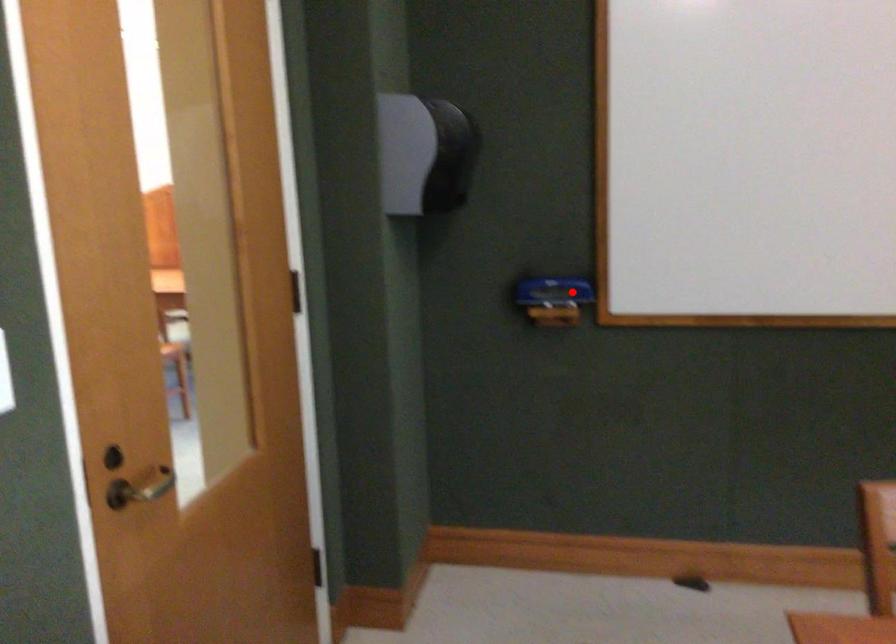
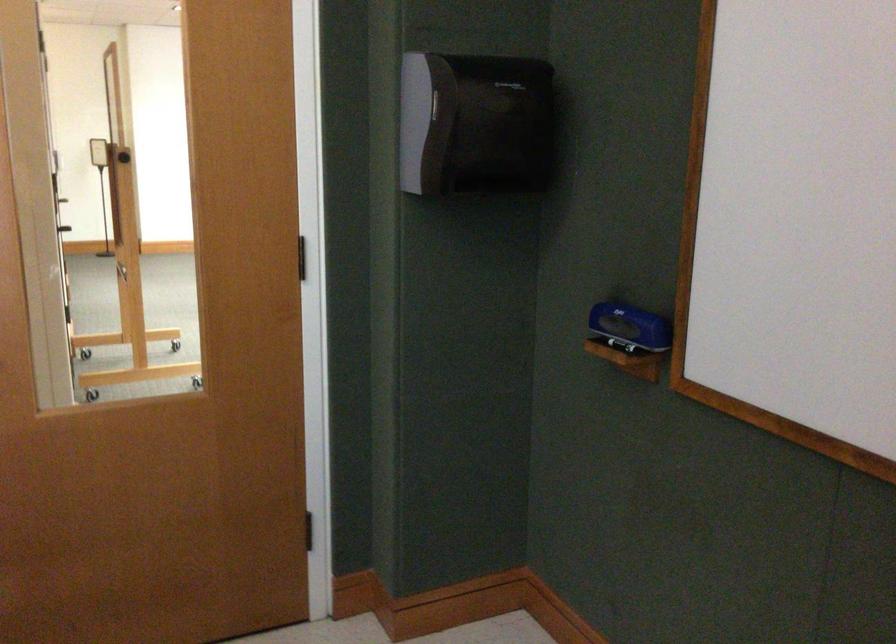
Question: I am providing you with two images of the same scene from different viewpoints. A red point is shown in image1. For the corresponding object point in image2, is it positioned nearer or farther from the camera?

Choices:
 (A) Nearer
 (B) Farther

Answer: (A)